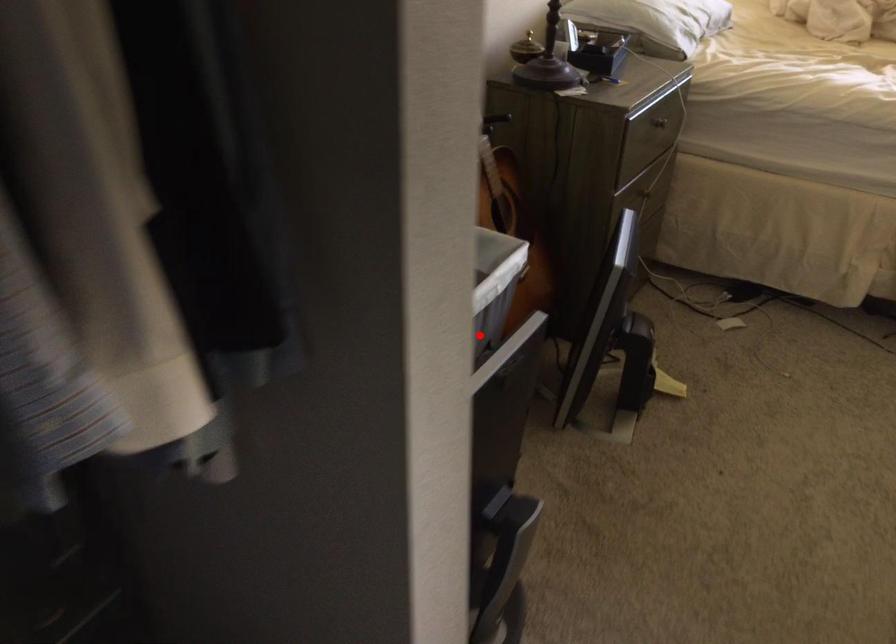
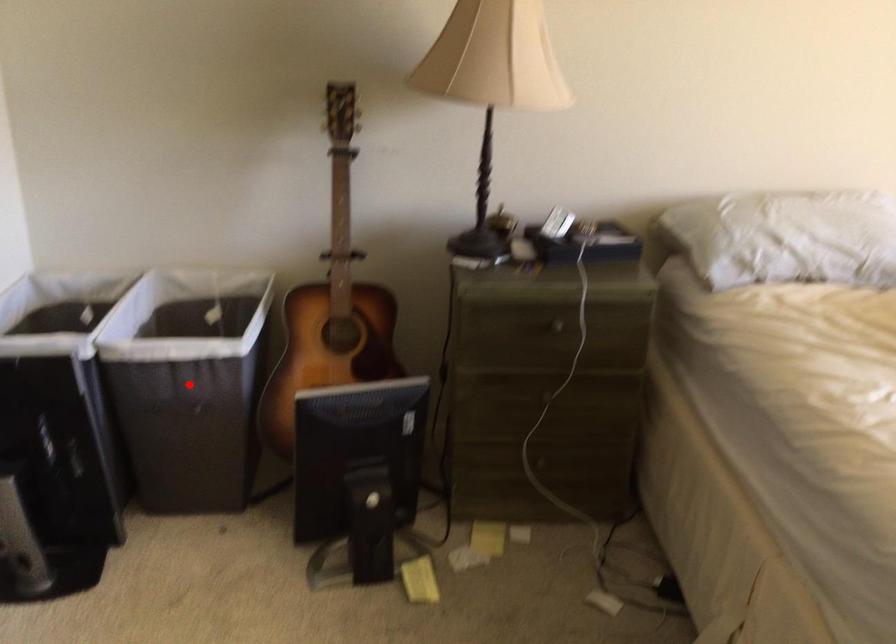
I am providing you with two images of the same scene from different viewpoints. A red point is marked on the first image and another point is marked on the second image. Does the point marked in image1 correspond to the same location as the one in image2?

Yes